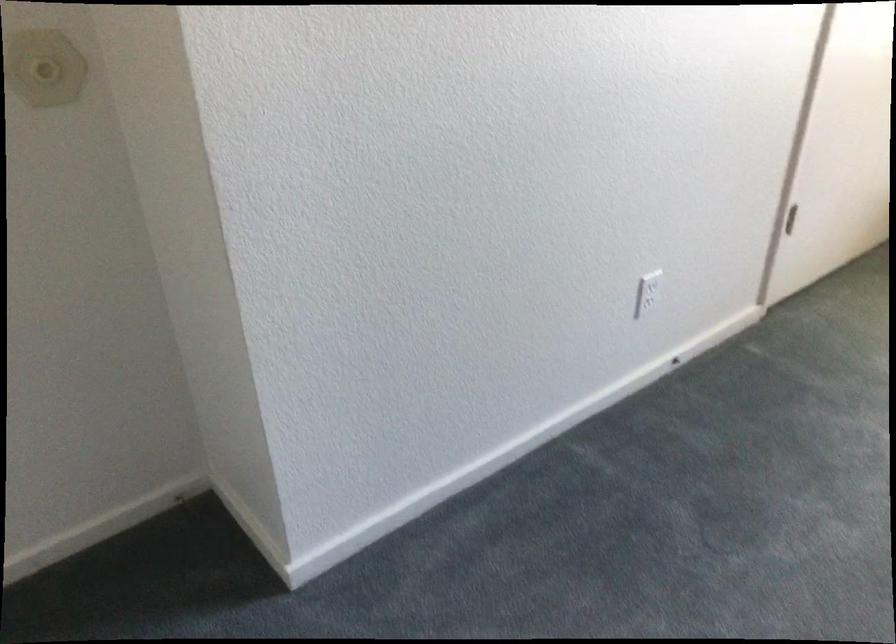
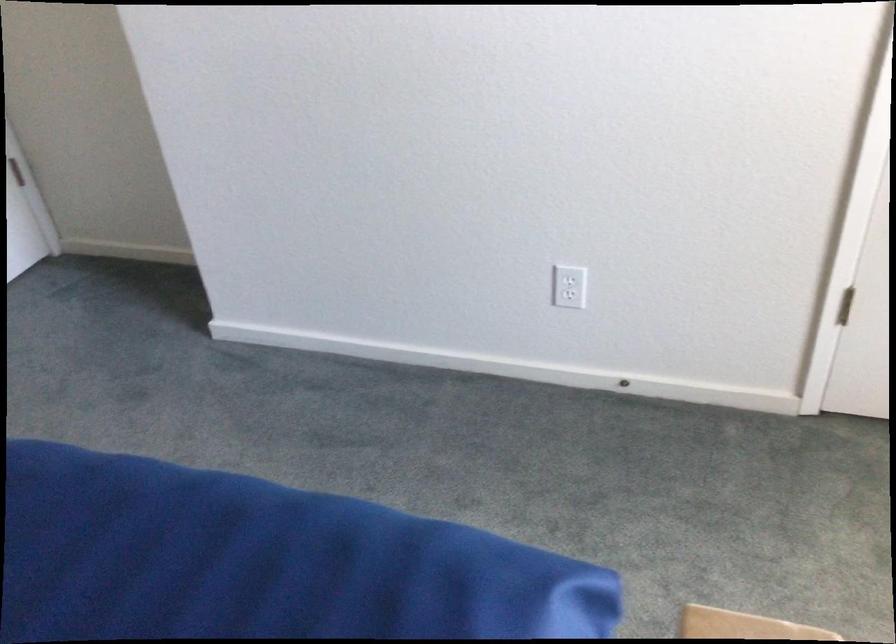
Locate, in the second image, the point that corresponds to the point at 641,301 in the first image.

(569, 295)